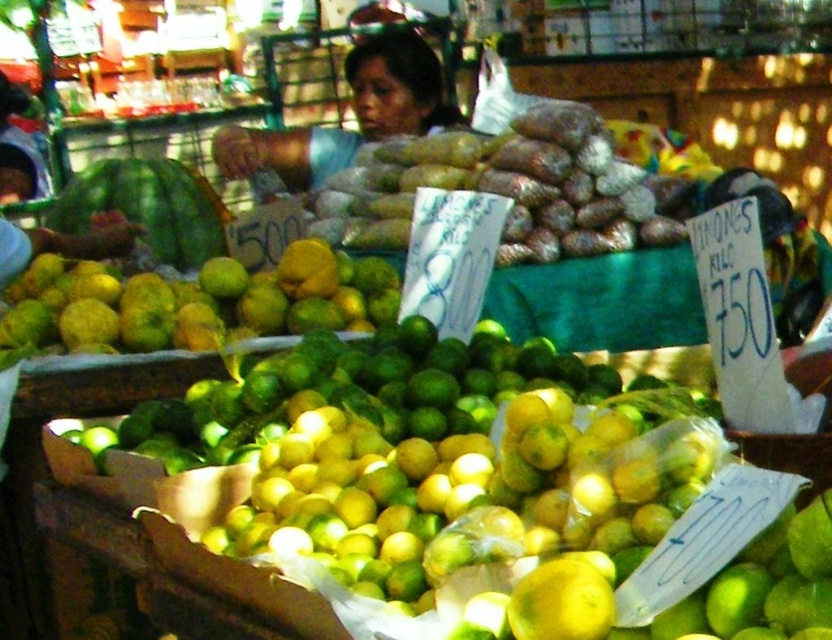
You are a customer at the fruit market and want to buy the yellow matte lemon at center. The seller is wearing a blue fabric shirt at center. Which one is closer to you, the lemon or the seller?

The seller wearing the blue fabric shirt at center is closer to you than the yellow matte lemon at center because the blue fabric shirt at center is further to the viewer than yellow matte lemon at center.

You are at a fruit market and see two items labeled as yellow matte citrus at center and yellow matte lemon at center. Which one is larger in size?

The yellow matte citrus at center is bigger than the yellow matte lemon at center.